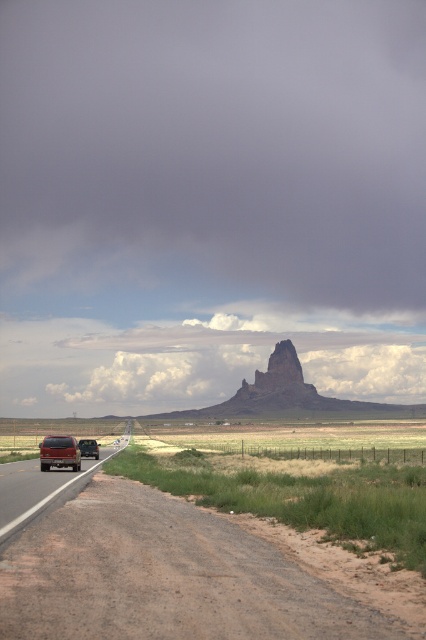
You are driving a car and see the point at coordinates (192, 576) on the smooth asphalt highway at center. Is the point on the road or off the road?

The point at coordinates (192, 576) is on the smooth asphalt highway at center, so it is on the road.

You are a delivery driver who needs to reach a destination 10 miles north. The smooth asphalt highway at center is the only road available. What direction should you drive relative to the highway?

Drive north along the smooth asphalt highway at center since it is the main road leading in that direction.